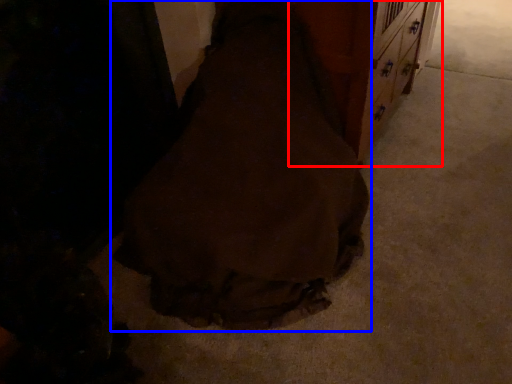
Question: Which object is closer to the camera taking this photo, dresser (highlighted by a red box) or fancy dress (highlighted by a blue box)?

Choices:
 (A) dresser
 (B) fancy dress

Answer: (B)